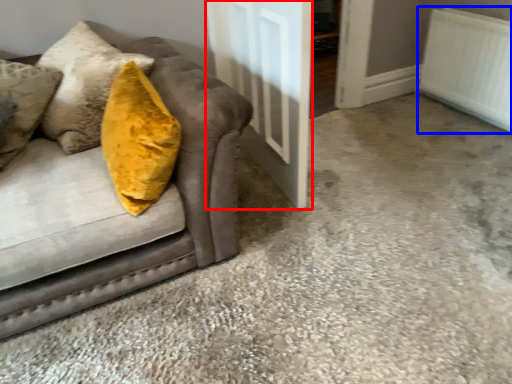
Question: Among these objects, which one is nearest to the camera, door (highlighted by a red box) or radiator (highlighted by a blue box)?

Choices:
 (A) door
 (B) radiator

Answer: (A)